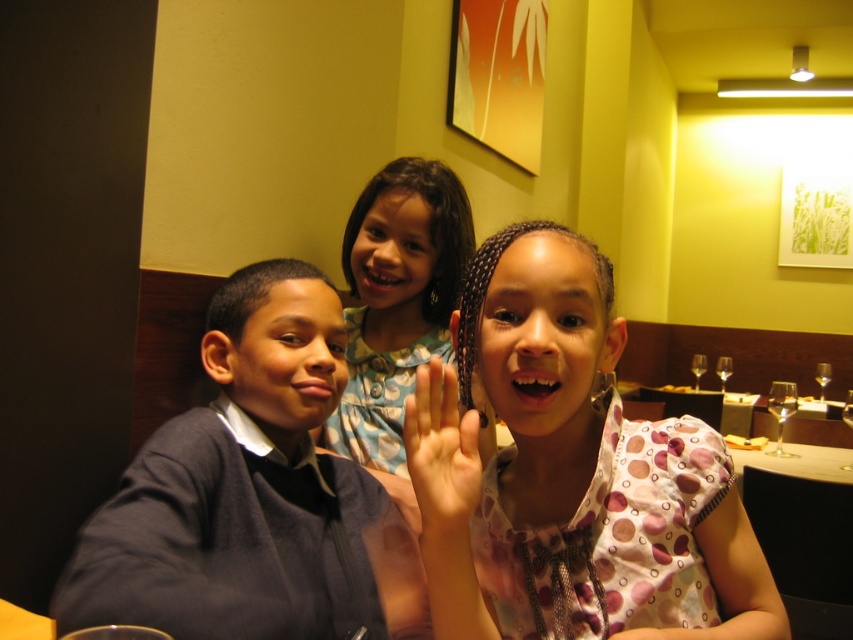
You are a photographer trying to capture a group photo of the children. The camera you are using has a minimum focus distance of 30 inches. Can you focus on the point at point (585, 424) without moving the camera?

The distance between point (585, 424) and the camera is 29.96 inches, which is less than the minimum focus distance of 30 inches. Therefore, the camera cannot focus on the point at point (585, 424) without moving it closer.

In the scene shown: You are a photographer trying to capture a group photo of the children. The dark blue sweater at left and the light skin tone palm at center are in your frame. Based on their positions, which object is wider in the photo?

The dark blue sweater at left might be wider than light skin tone palm at center according to the description.